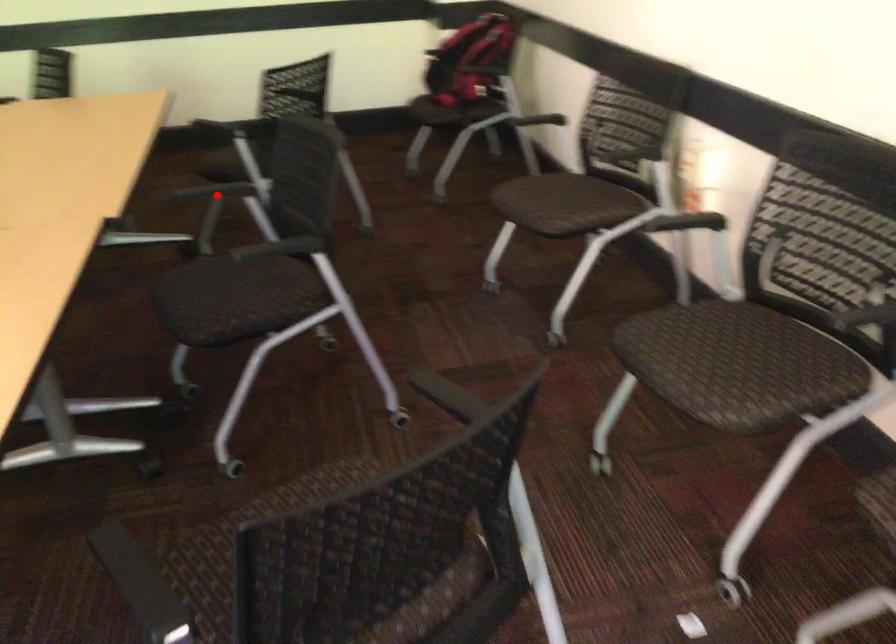
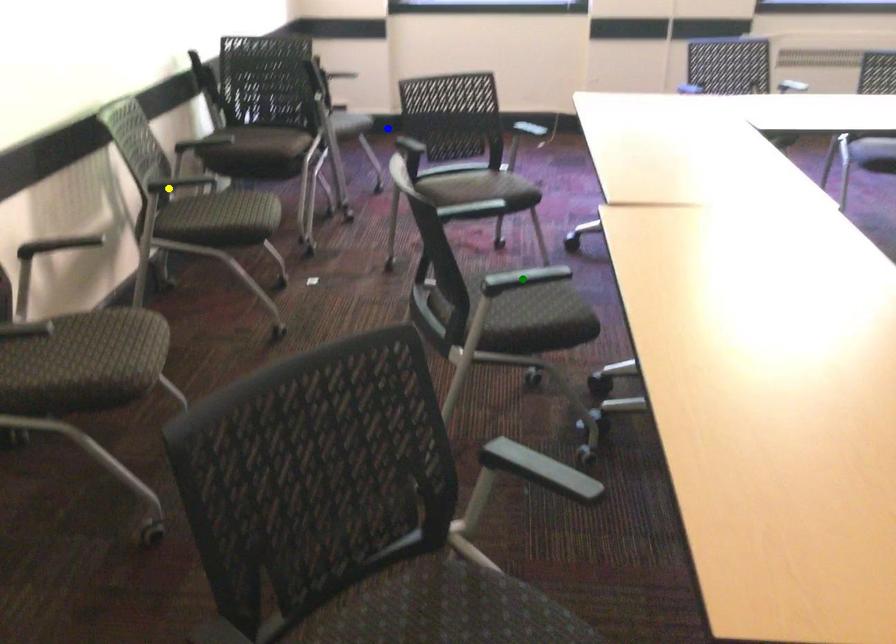
Question: I am providing you with two images of the same scene from different viewpoints. A red point is marked on the first image. You are given multiple points on the second image. Can you choose the point in image 2 that corresponds to the point in image 1?

Choices:
 (A) green point
 (B) blue point
 (C) yellow point

Answer: (A)